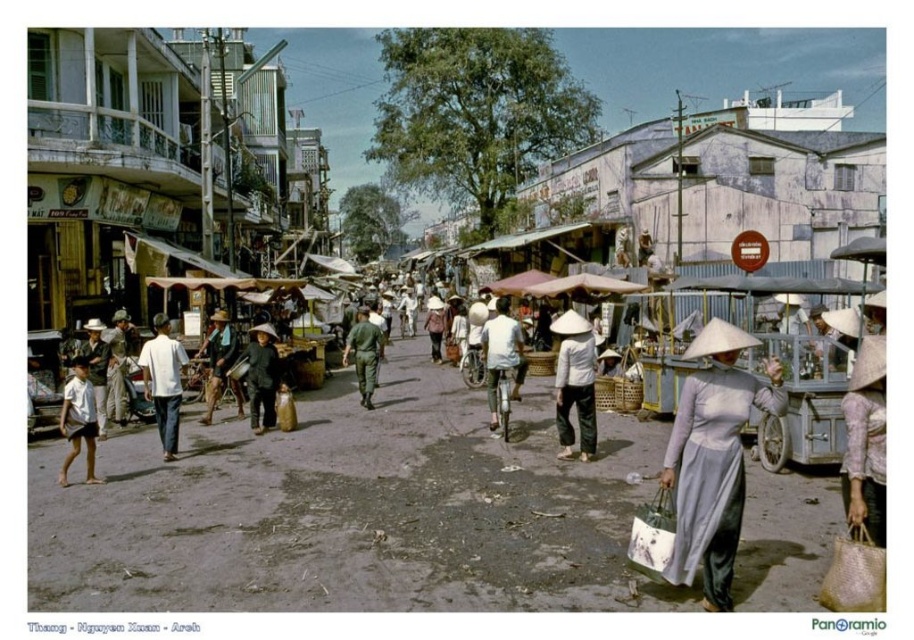
Which is more to the left, white cotton ao dai at center or dark blue fabric hat at center?

dark blue fabric hat at center is more to the left.

How far apart are white cotton ao dai at center and dark blue fabric hat at center?

They are 4.75 meters apart.

Is point (594, 440) positioned in front of point (271, 378)?

Yes.

Image resolution: width=914 pixels, height=640 pixels. What are the coordinates of `white cotton ao dai at center` in the screenshot? It's located at (575, 384).

Does dark blue fabric hat at center have a lesser height compared to dark brown wooden stick at center?

Yes.

Can you confirm if dark blue fabric hat at center is positioned below dark brown wooden stick at center?

No, dark blue fabric hat at center is not below dark brown wooden stick at center.

Where is `dark blue fabric hat at center`? dark blue fabric hat at center is located at coordinates (262, 376).

This screenshot has width=914, height=640. What do you see at coordinates (713, 458) in the screenshot?
I see `white matte ao dai at center` at bounding box center [713, 458].

Can you confirm if white matte ao dai at center is thinner than dark brown wooden stick at center?

Yes, white matte ao dai at center is thinner than dark brown wooden stick at center.

Is point (677, 566) behind point (226, 372)?

No, it is in front of (226, 372).

Where is `white matte ao dai at center`? Image resolution: width=914 pixels, height=640 pixels. white matte ao dai at center is located at coordinates (713, 458).